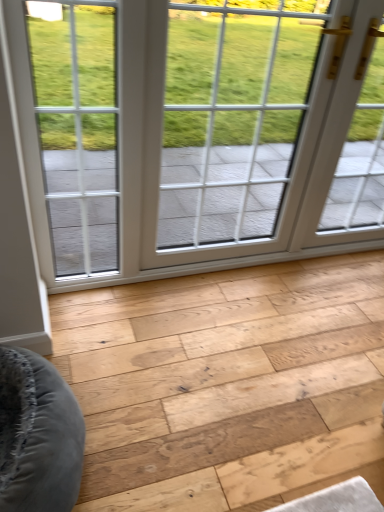
What do you see at coordinates (227, 385) in the screenshot?
I see `natural wood plank at center` at bounding box center [227, 385].

Image resolution: width=384 pixels, height=512 pixels. What are the coordinates of `natural wood plank at center` in the screenshot? It's located at (227, 385).

What is the approximate height of white glass window at center?

It is 3.46 feet.

Where is `white glass window at center`? The image size is (384, 512). white glass window at center is located at coordinates (196, 131).

This screenshot has height=512, width=384. What do you see at coordinates (196, 131) in the screenshot? I see `white glass window at center` at bounding box center [196, 131].

At what (x,y) coordinates should I click in order to perform the action: click on natural wood plank at center. Please return your answer as a coordinate pair (x, y). The width and height of the screenshot is (384, 512). Looking at the image, I should click on (227, 385).

Looking at this image, which is more to the right, white glass window at center or natural wood plank at center?

natural wood plank at center.

Between white glass window at center and natural wood plank at center, which one is positioned in front?

natural wood plank at center is more forward.

Is point (40, 201) in front of point (154, 505)?

No, (40, 201) is further to viewer.

From the image's perspective, who appears lower, white glass window at center or natural wood plank at center?

natural wood plank at center appears lower in the image.

From a real-world perspective, which is physically above, white glass window at center or natural wood plank at center?

white glass window at center is physically above.

Is white glass window at center wider than natural wood plank at center?

In fact, white glass window at center might be narrower than natural wood plank at center.

Considering the sizes of white glass window at center and natural wood plank at center in the image, is white glass window at center taller or shorter than natural wood plank at center?

white glass window at center is taller than natural wood plank at center.

In terms of size, does white glass window at center appear bigger or smaller than natural wood plank at center?

white glass window at center is smaller than natural wood plank at center.

Choose the correct answer: Is white glass window at center inside natural wood plank at center or outside it?

white glass window at center is spatially situated outside natural wood plank at center.

Is white glass window at center with natural wood plank at center?

No, white glass window at center is not with natural wood plank at center.

Is white glass window at center facing away from natural wood plank at center?

No, natural wood plank at center is not at the back of white glass window at center.

Measure the distance between white glass window at center and natural wood plank at center.

white glass window at center and natural wood plank at center are 30.53 inches apart from each other.

At what (x,y) coordinates should I click in order to perform the action: click on window lying above the natural wood plank at center (from the image's perspective). Please return your answer as a coordinate pair (x, y). The height and width of the screenshot is (512, 384). Looking at the image, I should click on (196, 131).

Considering the positions of objects natural wood plank at center and white glass window at center in the image provided, who is more to the left, natural wood plank at center or white glass window at center?

white glass window at center is more to the left.

Considering the positions of objects natural wood plank at center and white glass window at center in the image provided, who is in front, natural wood plank at center or white glass window at center?

natural wood plank at center.

Between point (356, 384) and point (263, 121), which one is positioned in front?

The point (356, 384) is closer.

From the image's perspective, is natural wood plank at center located above or below white glass window at center?

natural wood plank at center is below white glass window at center.

From a real-world perspective, relative to white glass window at center, is natural wood plank at center vertically above or below?

From a real-world perspective, natural wood plank at center is physically below white glass window at center.

From the picture: Which object is wider, natural wood plank at center or white glass window at center?

natural wood plank at center is wider.

Is natural wood plank at center shorter than white glass window at center?

Yes, natural wood plank at center is shorter than white glass window at center.

Who is smaller, natural wood plank at center or white glass window at center?

white glass window at center is smaller.

Do you think natural wood plank at center is within white glass window at center, or outside of it?

natural wood plank at center lies outside white glass window at center.

Does natural wood plank at center touch white glass window at center?

No, natural wood plank at center is not in contact with white glass window at center.

Is white glass window at center at the back of natural wood plank at center?

No.

Find the location of `window that appears above the natural wood plank at center (from the image's perspective)`. window that appears above the natural wood plank at center (from the image's perspective) is located at coordinates (196, 131).

Identify the location of plank that appears below the white glass window at center (from a real-world perspective). The image size is (384, 512). (227, 385).

I want to click on plank below the white glass window at center (from the image's perspective), so 227,385.